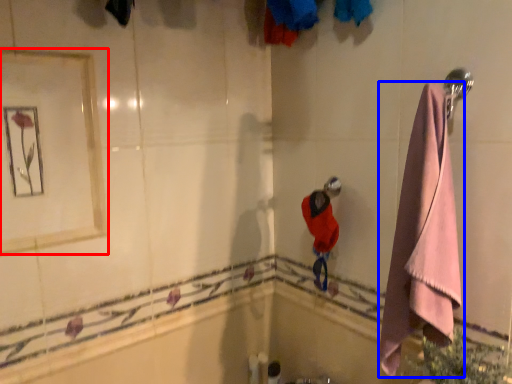
Question: Which of the following is the closest to the observer, mirror (highlighted by a red box) or towel (highlighted by a blue box)?

Choices:
 (A) mirror
 (B) towel

Answer: (B)